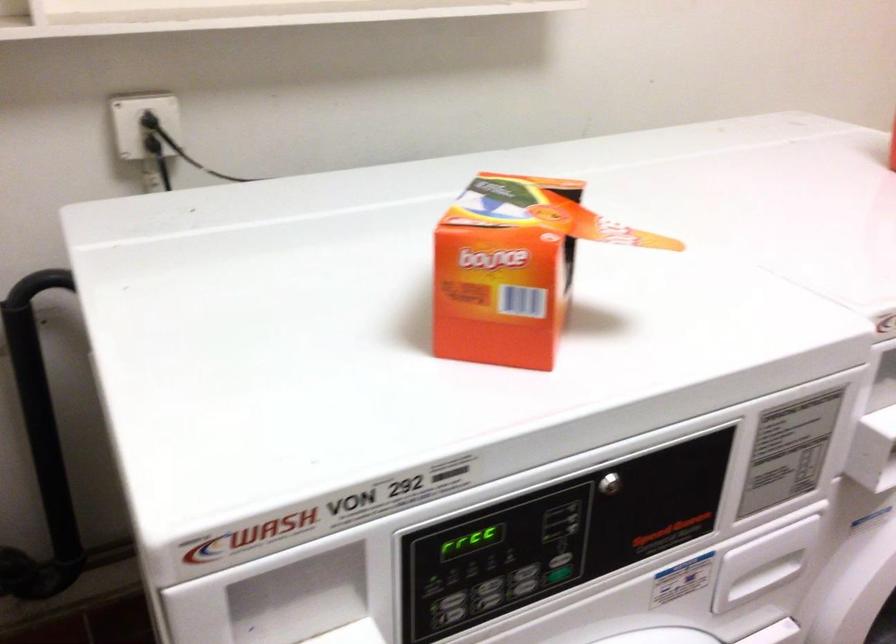
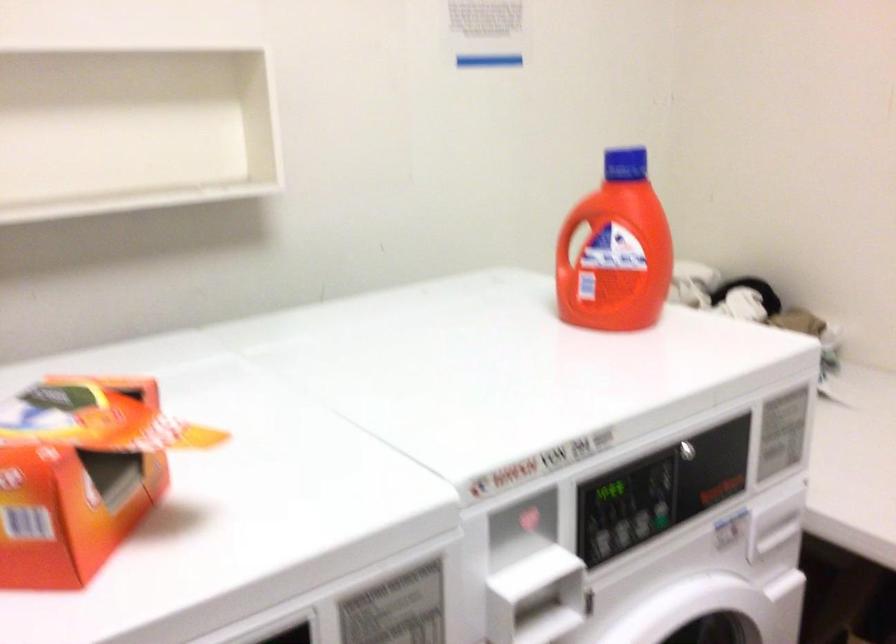
The point at [558,289] is marked in the first image. Where is the corresponding point in the second image?

(73, 498)